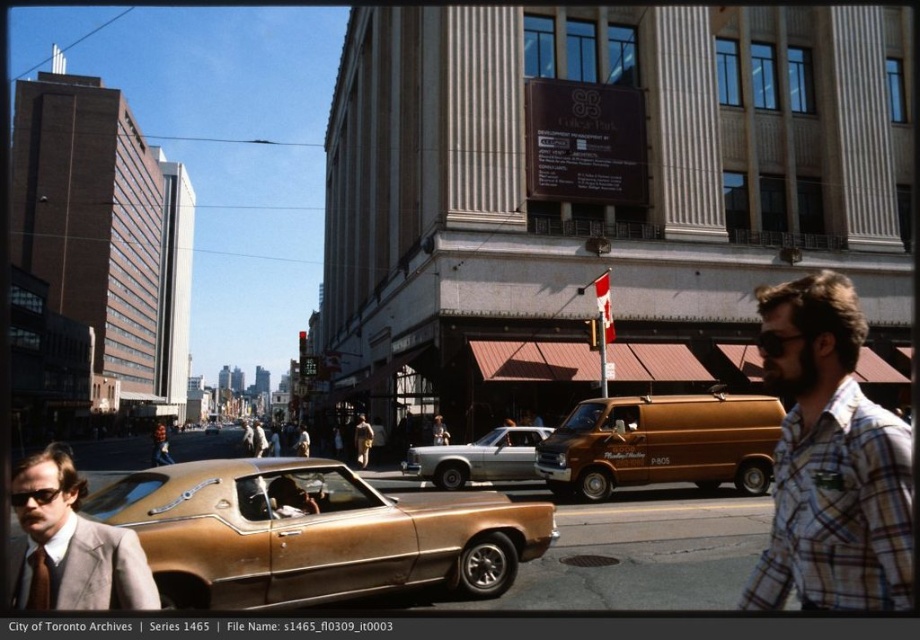
Question: Which of the following is the farthest from the observer?

Choices:
 (A) black plastic goggles at center
 (B) light brown suit at left

Answer: (A)

Question: Which object is farther from the camera taking this photo?

Choices:
 (A) gold metallic car at center
 (B) black plastic goggles at center

Answer: (A)

Question: Can you confirm if gold metallic car at center is thinner than silver metallic sedan at center?

Choices:
 (A) no
 (B) yes

Answer: (A)

Question: Can you confirm if light brown suit at left is wider than black plastic goggles at center?

Choices:
 (A) no
 (B) yes

Answer: (A)

Question: Does light brown suit at left come behind black plastic goggles at center?

Choices:
 (A) yes
 (B) no

Answer: (B)

Question: Which of these objects is positioned farthest from the silver metallic sedan at center?

Choices:
 (A) matte black sunglasses at lower left
 (B) light brown suit at left
 (C) gold metallic car at center

Answer: (A)